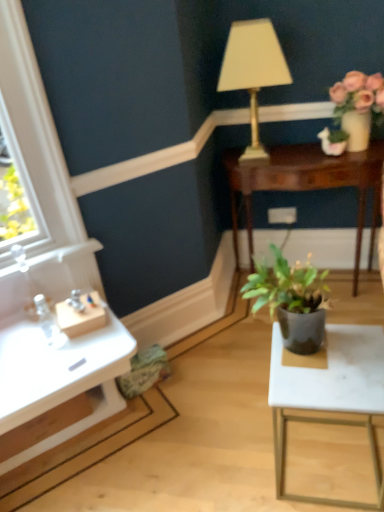
Question: Is green matte plant pot at upper right, which is the 1th houseplant in right-to-left order, inside the boundaries of gold metallic lamp at upper center, or outside?

Choices:
 (A) outside
 (B) inside

Answer: (A)

Question: Considering the positions of green matte plant pot at upper right, which is the 1th houseplant in right-to-left order, and gold metallic lamp at upper center in the image, is green matte plant pot at upper right, which is the 1th houseplant in right-to-left order, taller or shorter than gold metallic lamp at upper center?

Choices:
 (A) tall
 (B) short

Answer: (B)

Question: Estimate the real-world distances between objects in this image. Which object is closer to the green matte plant pot at upper right, positioned as the 1th houseplant in top-to-bottom order?

Choices:
 (A) gold metallic lamp at upper center
 (B) mahogany wood table at center, positioned as the 1th table in top-to-bottom order
 (C) white marble table at lower right, which ranks as the first table in front-to-back order
 (D) dark green matte plant pot at center, the first houseplant from the bottom
 (E) green fabric swivel chair at lower center

Answer: (B)

Question: Considering the real-world distances, which object is farthest from the mahogany wood table at center, positioned as the 1th table in top-to-bottom order?

Choices:
 (A) white marble table at lower right, positioned as the second table in back-to-front order
 (B) gold metallic lamp at upper center
 (C) green fabric swivel chair at lower center
 (D) matte pink flowers at upper right
 (E) dark green matte plant pot at center, positioned as the first houseplant in front-to-back order

Answer: (C)